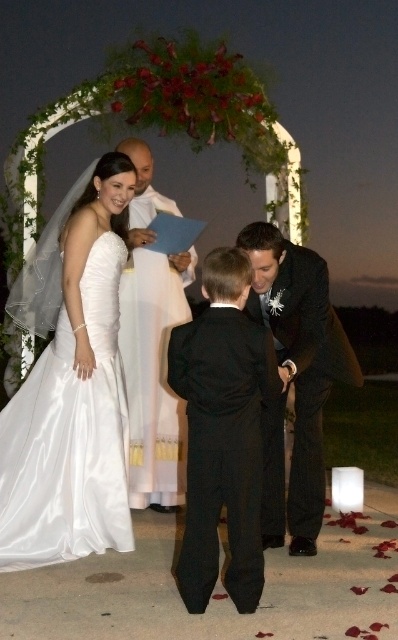
Consider the image. Can you confirm if satin dress at center is smaller than white satin robe at center?

No.

Is point (99, 339) closer to camera compared to point (134, 202)?

Yes, it is.

At what (x,y) coordinates should I click in order to perform the action: click on satin dress at center. Please return your answer as a coordinate pair (x, y). Looking at the image, I should click on (70, 385).

Which is in front, point (339, 324) or point (152, 188)?

Point (339, 324) is in front.

Looking at this image, does shiny black suit at center have a greater width compared to white satin robe at center?

Yes.

Who is more distant from viewer, (347, 374) or (128, 433)?

The point (128, 433) is more distant.

Where is `shiny black suit at center`? shiny black suit at center is located at coordinates click(296, 378).

Is satin white dress at center positioned in front of shiny black suit at center?

No, satin white dress at center is further to the viewer.

Looking at this image, does satin white dress at center appear over shiny black suit at center?

Yes, satin white dress at center is above shiny black suit at center.

You are a GUI agent. You are given a task and a screenshot of the screen. Output one action in this format:
    pyautogui.click(x=<x>, y=<y>)
    Task: Click on the satin white dress at center
    Image resolution: width=398 pixels, height=640 pixels.
    Given the screenshot: What is the action you would take?
    pyautogui.click(x=72, y=380)

The height and width of the screenshot is (640, 398). I want to click on satin white dress at center, so click(x=72, y=380).